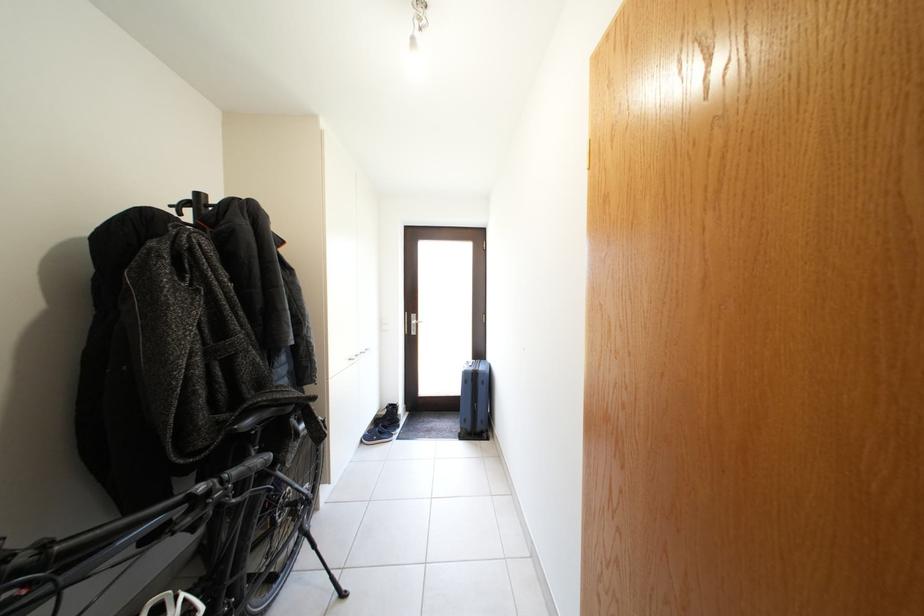
I want to click on black coat hook, so click(x=191, y=204).